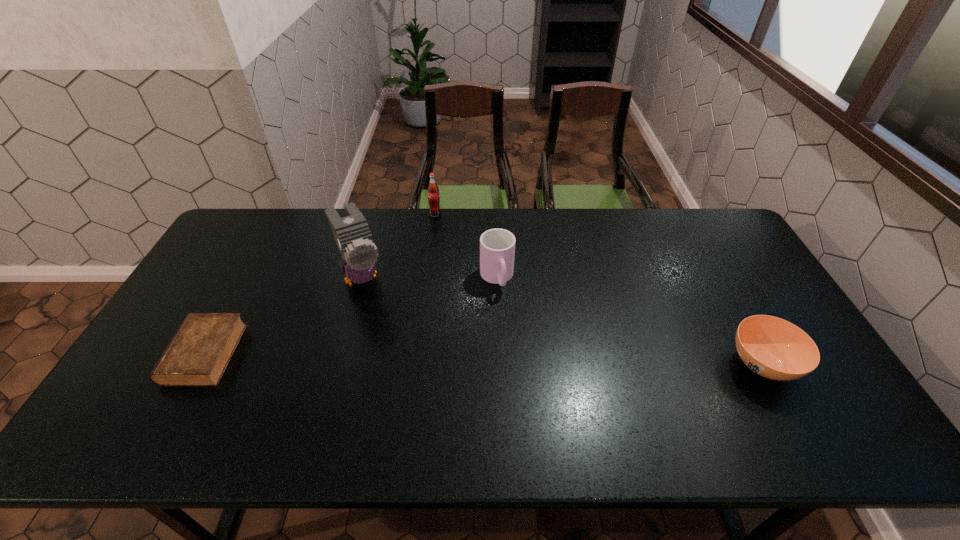
At what (x,y) coordinates should I click in order to perform the action: click on diary. Please return your answer as a coordinate pair (x, y). The height and width of the screenshot is (540, 960). Looking at the image, I should click on (198, 354).

This screenshot has width=960, height=540. Find the location of `the shortest object`. the shortest object is located at coordinates (198, 354).

Find the location of a particular element. This screenshot has width=960, height=540. the second shortest object is located at coordinates (774, 348).

You are a GUI agent. You are given a task and a screenshot of the screen. Output one action in this format:
    pyautogui.click(x=<x>, y=<y>)
    Task: Click on the rightmost object
    
    Given the screenshot: What is the action you would take?
    pyautogui.click(x=774, y=348)

This screenshot has width=960, height=540. In order to click on the second object from left to right in this screenshot , I will do `click(353, 237)`.

The image size is (960, 540). What are the coordinates of `bird` in the screenshot? It's located at (353, 237).

Find the location of a particular element. the third object from right to left is located at coordinates (433, 191).

This screenshot has width=960, height=540. I want to click on the farthest object, so click(x=433, y=191).

You are a GUI agent. You are given a task and a screenshot of the screen. Output one action in this format:
    pyautogui.click(x=<x>, y=<y>)
    Task: Click on the third tallest object
    
    Given the screenshot: What is the action you would take?
    pyautogui.click(x=497, y=246)

Locate an element on the screen. The image size is (960, 540). cup is located at coordinates (497, 246).